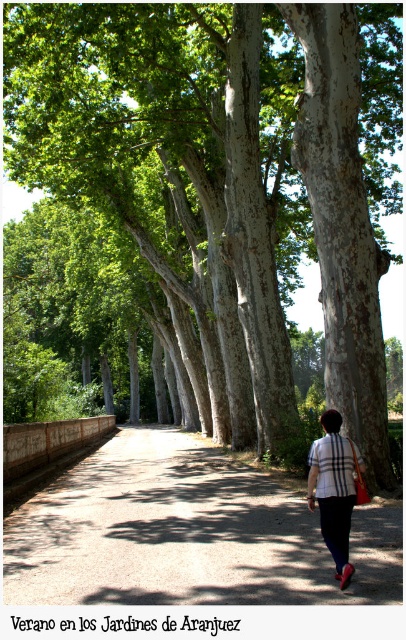
Question: Which point appears closest to the camera in this image?

Choices:
 (A) (345, 468)
 (B) (121, 593)

Answer: (B)

Question: Is dirt/gravel path at center above plaid fabric shirt at center?

Choices:
 (A) no
 (B) yes

Answer: (A)

Question: Does dirt/gravel path at center appear on the right side of plaid fabric shirt at center?

Choices:
 (A) yes
 (B) no

Answer: (B)

Question: Is dirt/gravel path at center behind plaid fabric shirt at center?

Choices:
 (A) no
 (B) yes

Answer: (A)